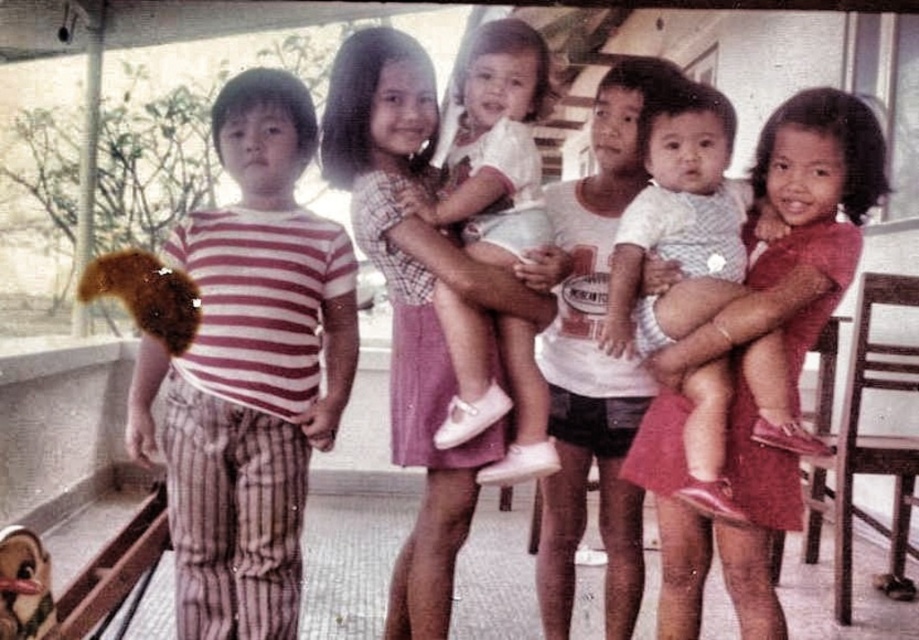
Between striped fabric shirt at left and white matte dress at center, which one has less height?

With less height is white matte dress at center.

Which is below, striped fabric shirt at left or white matte dress at center?

striped fabric shirt at left is lower down.

Is point (235, 276) closer to camera compared to point (464, 424)?

No, (235, 276) is behind (464, 424).

Find the location of a particular element. This screenshot has height=640, width=919. striped fabric shirt at left is located at coordinates (250, 369).

In the scene shown: Can you confirm if striped fabric shirt at left is taller than white cotton shirt at center?

In fact, striped fabric shirt at left may be shorter than white cotton shirt at center.

Describe the element at coordinates (250, 369) in the screenshot. Image resolution: width=919 pixels, height=640 pixels. I see `striped fabric shirt at left` at that location.

Identify the location of striped fabric shirt at left. This screenshot has height=640, width=919. (250, 369).

Between point (553, 508) and point (505, 483), which one is positioned behind?

The point (553, 508) is behind.

Between white cotton shirt at center and white matte dress at center, which one has more height?

With more height is white cotton shirt at center.

Find the location of a particular element. The height and width of the screenshot is (640, 919). white cotton shirt at center is located at coordinates click(596, 362).